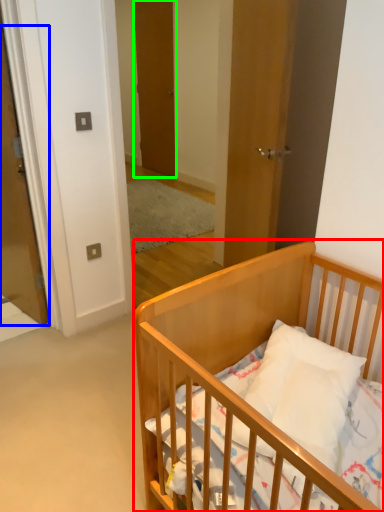
Question: Considering the real-world distances, which object is closest to infant bed (highlighted by a red box)? door (highlighted by a blue box) or door (highlighted by a green box).

Choices:
 (A) door
 (B) door

Answer: (A)